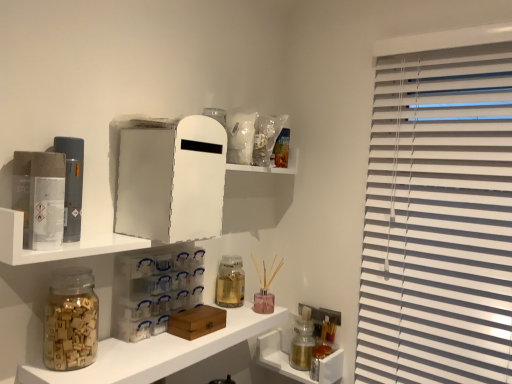
Question: Does translucent glass jar at lower left, the 2th shelf when ordered from top to bottom, come behind translucent glass jar at center, which appears as the 1th bottle when viewed from the front?

Choices:
 (A) no
 (B) yes

Answer: (A)

Question: From a real-world perspective, is translucent glass jar at lower left, which is the 1th shelf in bottom-to-top order, on translucent glass jar at center, which appears as the 1th bottle when viewed from the front?

Choices:
 (A) yes
 (B) no

Answer: (B)

Question: Does translucent glass jar at lower left, which is the 1th shelf in bottom-to-top order, have a smaller size compared to translucent glass jar at center, positioned as the second bottle in bottom-to-top order?

Choices:
 (A) no
 (B) yes

Answer: (A)

Question: From the image's perspective, is translucent glass jar at lower left, the 2th shelf when ordered from top to bottom, under translucent glass jar at center, placed as the first bottle when sorted from left to right?

Choices:
 (A) yes
 (B) no

Answer: (A)

Question: Can you confirm if translucent glass jar at lower left, the 2th shelf when ordered from top to bottom, is taller than translucent glass jar at center, which ranks as the second bottle in back-to-front order?

Choices:
 (A) yes
 (B) no

Answer: (B)

Question: In terms of height, does translucent glass jar at lower left, the 2th shelf when ordered from top to bottom, look taller or shorter compared to white matte medicine cabinet at upper center?

Choices:
 (A) tall
 (B) short

Answer: (B)

Question: Is point (115, 372) closer or farther from the camera than point (164, 223)?

Choices:
 (A) farther
 (B) closer

Answer: (B)

Question: Is translucent glass jar at lower left, which is the 1th shelf in bottom-to-top order, inside the boundaries of white matte medicine cabinet at upper center, or outside?

Choices:
 (A) inside
 (B) outside

Answer: (B)

Question: Is translucent glass jar at lower left, which is the 1th shelf in bottom-to-top order, in front of or behind white matte medicine cabinet at upper center in the image?

Choices:
 (A) front
 (B) behind

Answer: (A)

Question: Considering the positions of point (179, 307) and point (225, 345), is point (179, 307) closer or farther from the camera than point (225, 345)?

Choices:
 (A) farther
 (B) closer

Answer: (A)

Question: From the image's perspective, relative to translucent glass jar at lower left, the 2th shelf when ordered from top to bottom, is transparent plastic drawers at center, positioned as the second cabinet in bottom-to-top order, above or below?

Choices:
 (A) above
 (B) below

Answer: (A)

Question: From a real-world perspective, is transparent plastic drawers at center, the second cabinet in the right-to-left sequence, physically located above or below translucent glass jar at lower left, which is the 1th shelf in bottom-to-top order?

Choices:
 (A) above
 (B) below

Answer: (A)

Question: In terms of width, does transparent plastic drawers at center, the first cabinet from the top, look wider or thinner when compared to translucent glass jar at lower left, which is the 1th shelf in bottom-to-top order?

Choices:
 (A) wide
 (B) thin

Answer: (B)

Question: Is metallic silver canisters at lower right, which is counted as the second cabinet, starting from the top, spatially inside white matte medicine cabinet at upper center, or outside of it?

Choices:
 (A) inside
 (B) outside

Answer: (B)

Question: Would you say metallic silver canisters at lower right, which is counted as the second cabinet, starting from the top, is to the left or to the right of white matte medicine cabinet at upper center in the picture?

Choices:
 (A) left
 (B) right

Answer: (B)